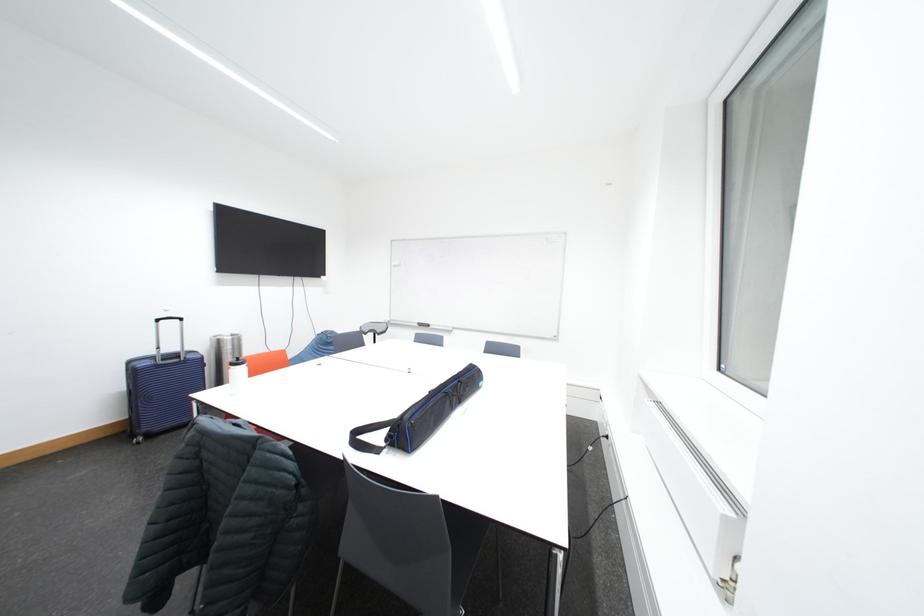
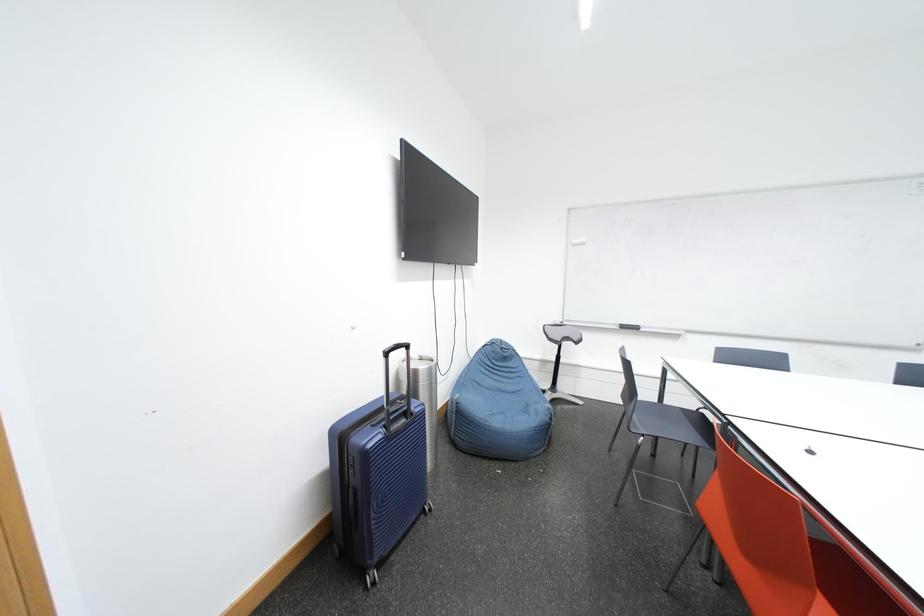
Which direction would the cameraman need to move to produce the second image?

The movement direction of the cameraman is left, forward.